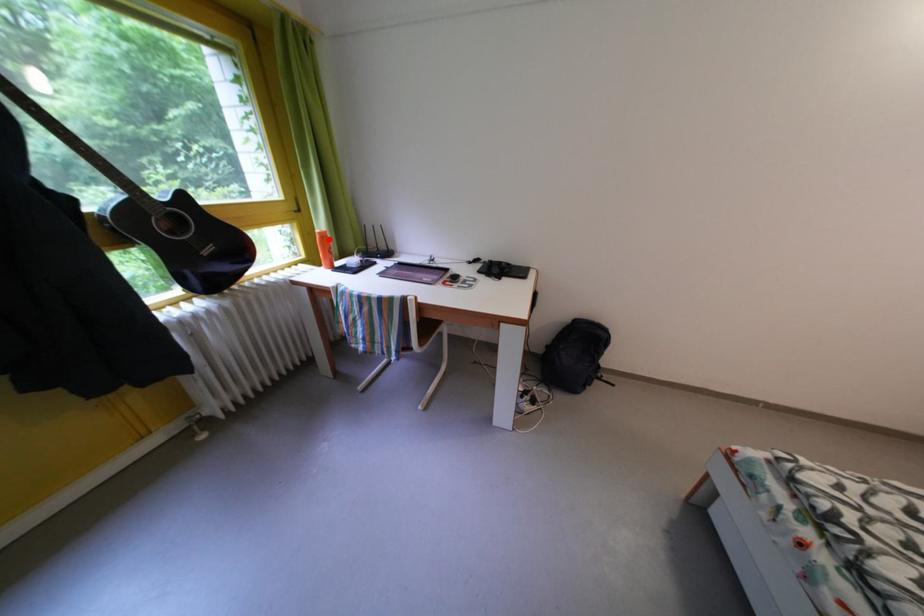
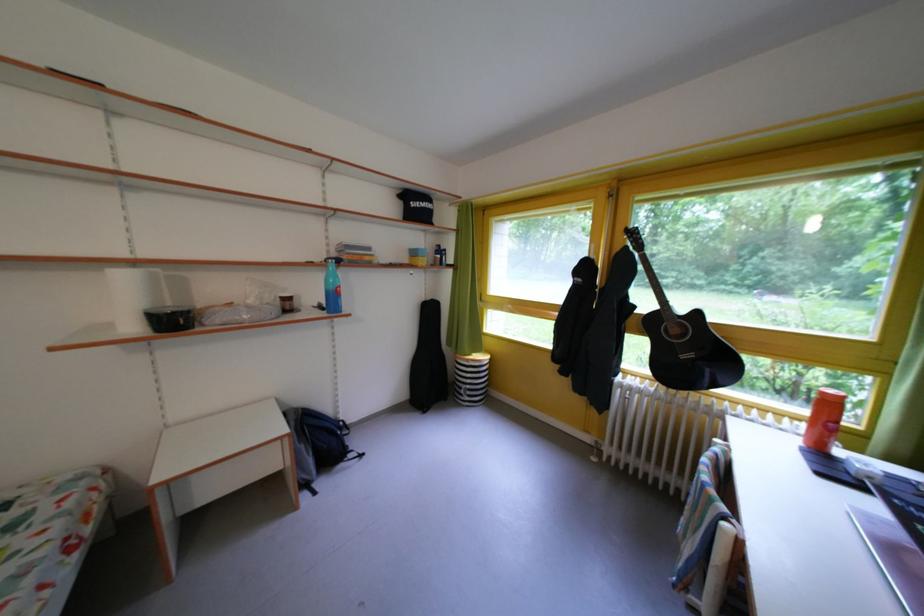
Locate, in the second image, the point that corresponds to the highlighted location in the first image.

(833, 399)